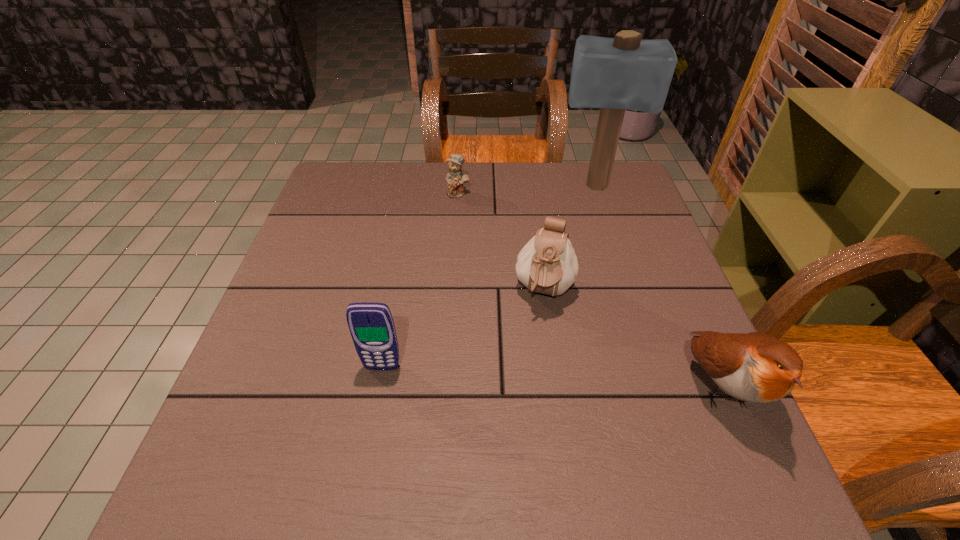
This screenshot has height=540, width=960. In order to click on vacant space on the desktop that is between the leftmost object and the bird and is positioned on the front-facing side of the shortest object in this screenshot , I will do `click(589, 379)`.

Locate an element on the screen. Image resolution: width=960 pixels, height=540 pixels. free space on the desktop that is between the cellular telephone and the bird and is positioned on the front-facing side of the third farthest object is located at coordinates (526, 375).

Find the location of a particular element. This screenshot has height=540, width=960. vacant space on the desktop that is between the cellular telephone and the bird and is positioned on the striking surface of the tallest object is located at coordinates click(x=596, y=380).